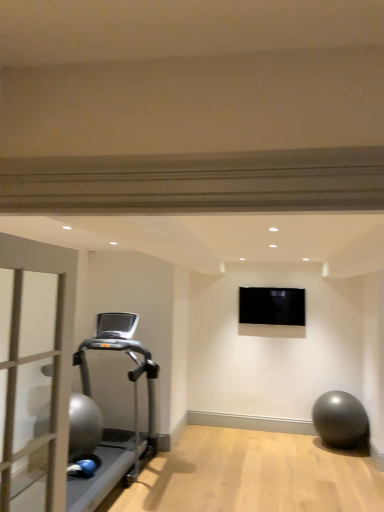
Question: Considering their positions, is black glossy tv at upper center located in front of or behind metallic gray ball at lower right?

Choices:
 (A) behind
 (B) front

Answer: (A)

Question: From their relative heights in the image, would you say black glossy tv at upper center is taller or shorter than metallic gray ball at lower right?

Choices:
 (A) tall
 (B) short

Answer: (B)

Question: Estimate the real-world distances between objects in this image. Which object is farther from the metallic gray ball at lower right?

Choices:
 (A) black glossy tv at upper center
 (B) matte gray door at left
 (C) silver metallic treadmill at left

Answer: (B)

Question: Which of these objects is positioned closest to the metallic gray ball at lower right?

Choices:
 (A) matte gray door at left
 (B) black glossy tv at upper center
 (C) silver metallic treadmill at left

Answer: (B)